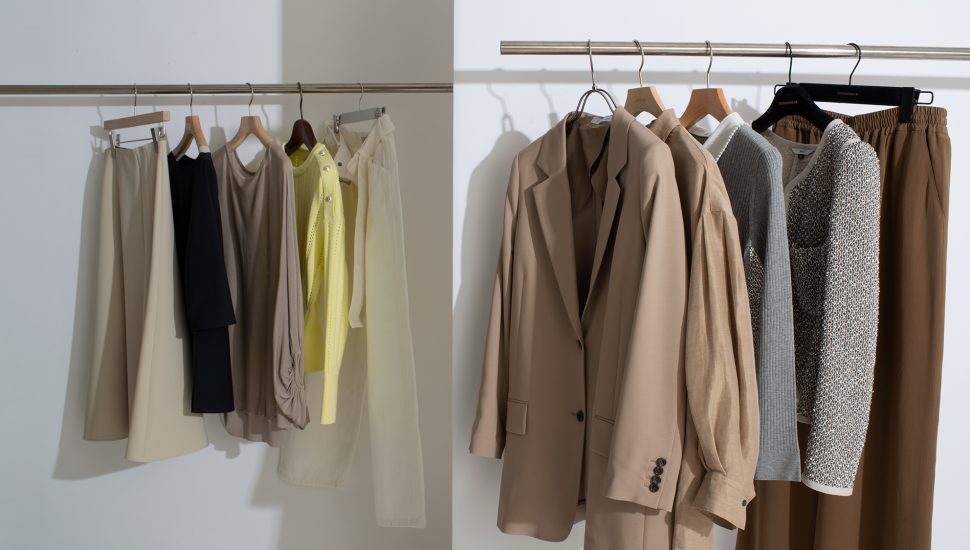
The width and height of the screenshot is (970, 550). What are the coordinates of `clothes hangers` in the screenshot? It's located at (162, 114), (190, 134), (249, 122), (300, 133), (354, 117), (602, 93), (642, 94), (718, 104), (817, 115), (874, 91).